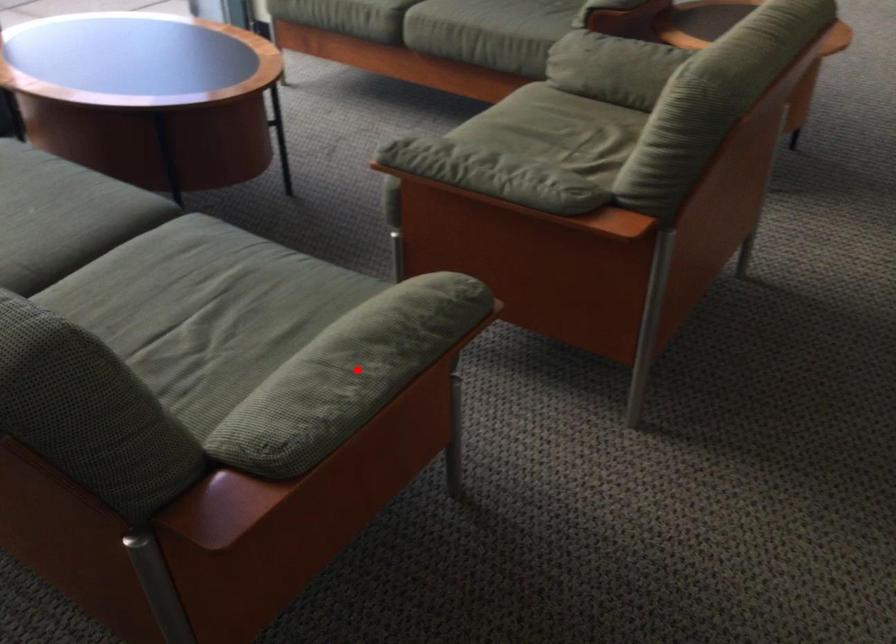
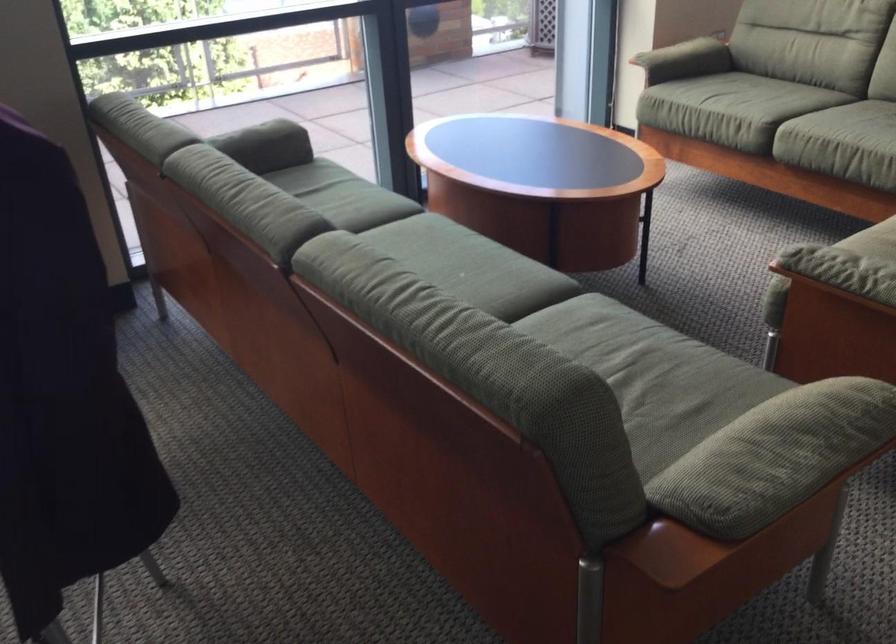
The point at the highlighted location is marked in the first image. Where is the corresponding point in the second image?

(776, 456)